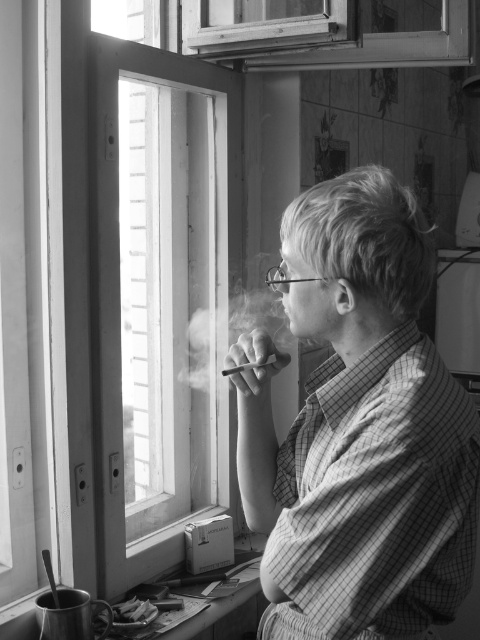
You are an observer in the room. You see the checkered fabric shirt at center and the smoketransparentsmoke at center. Which object is closer to the right side of the room?

The checkered fabric shirt at center is closer to the right side of the room than the smoketransparentsmoke at center.

You are standing in the room and see the point marked at coordinates (359, 428). What object is located at that point?

The point at coordinates (359, 428) marks the checkered fabric shirt at center.